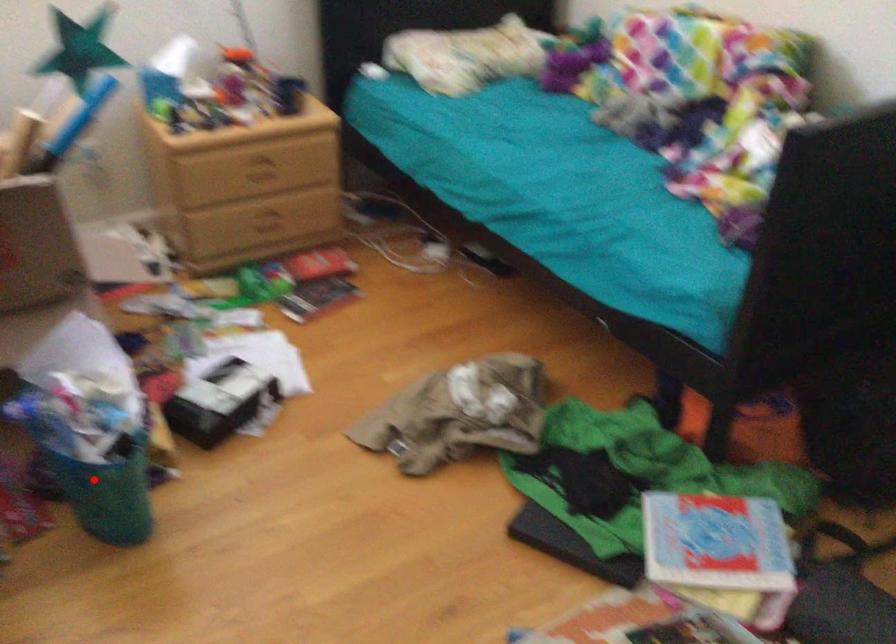
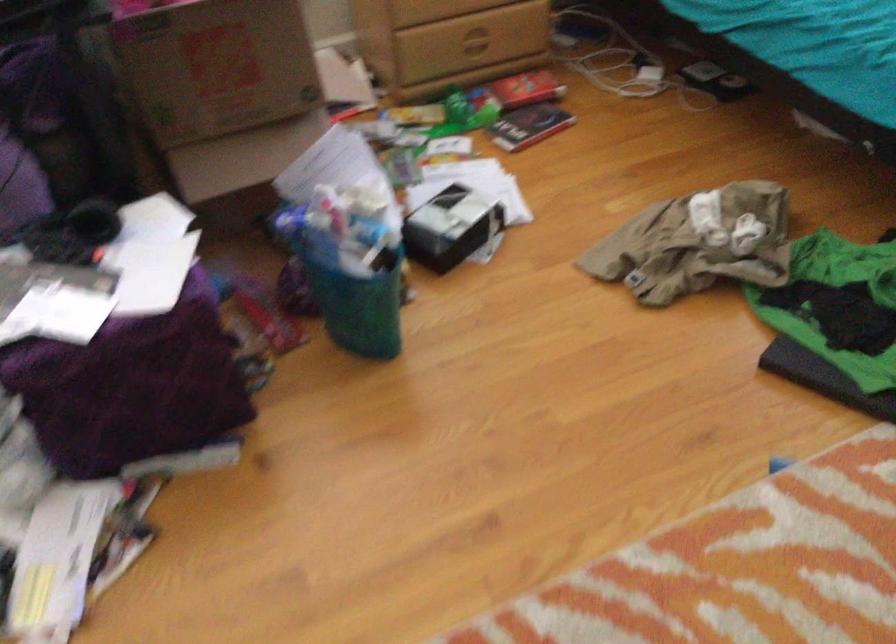
The point at the highlighted location is marked in the first image. Where is the corresponding point in the second image?

(352, 299)